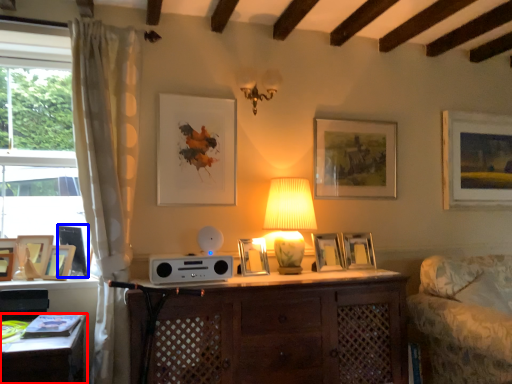
Question: Which point is further to the camera, desk (highlighted by a red box) or picture frame (highlighted by a blue box)?

Choices:
 (A) desk
 (B) picture frame

Answer: (B)